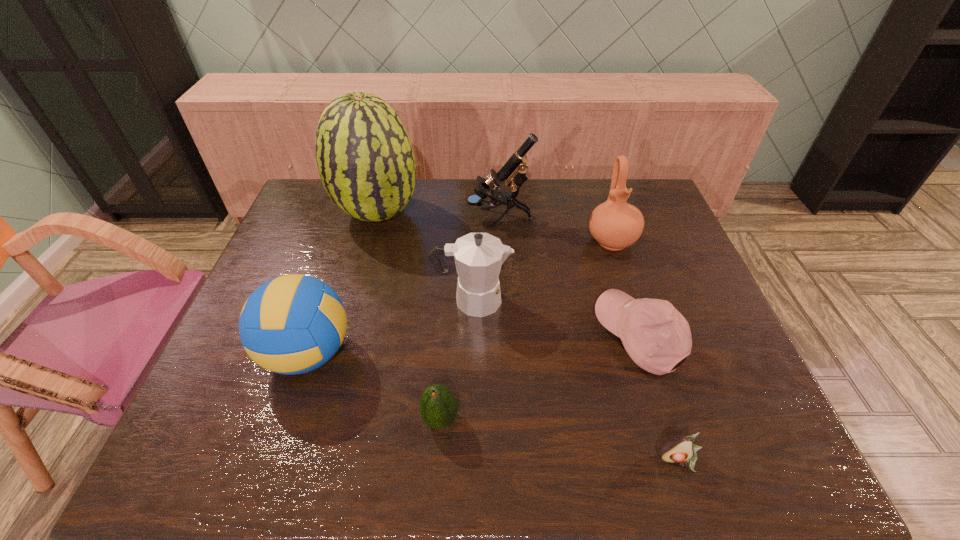
Identify the location of free space at the left edge of the desktop. (x=222, y=375).

This screenshot has height=540, width=960. Find the location of `free location at the right edge of the desktop`. free location at the right edge of the desktop is located at coordinates (682, 309).

This screenshot has height=540, width=960. Find the location of `vacant space at the near left corner`. vacant space at the near left corner is located at coordinates (244, 436).

This screenshot has height=540, width=960. I want to click on vacant space at the near right corner of the desktop, so click(797, 471).

Where is `free space between the tallest object and the volleyball`? The image size is (960, 540). free space between the tallest object and the volleyball is located at coordinates (343, 284).

Locate an element on the screen. free point between the nearest object and the coffeepot is located at coordinates (575, 380).

Where is `vacant space in between the microscope and the pottery`? This screenshot has width=960, height=540. vacant space in between the microscope and the pottery is located at coordinates (555, 230).

Image resolution: width=960 pixels, height=540 pixels. Find the location of `free space between the coffeepot and the seventh farthest object`. free space between the coffeepot and the seventh farthest object is located at coordinates click(456, 360).

This screenshot has width=960, height=540. I want to click on vacant area that lies between the nearer avocado and the coffeepot, so click(x=575, y=380).

You are a GUI agent. You are given a task and a screenshot of the screen. Output one action in this format:
    pyautogui.click(x=<x>, y=<y>)
    Task: Click on the vacant area that lies between the microscope and the farther avocado
    The image size is (960, 540).
    Given the screenshot: What is the action you would take?
    pyautogui.click(x=469, y=319)